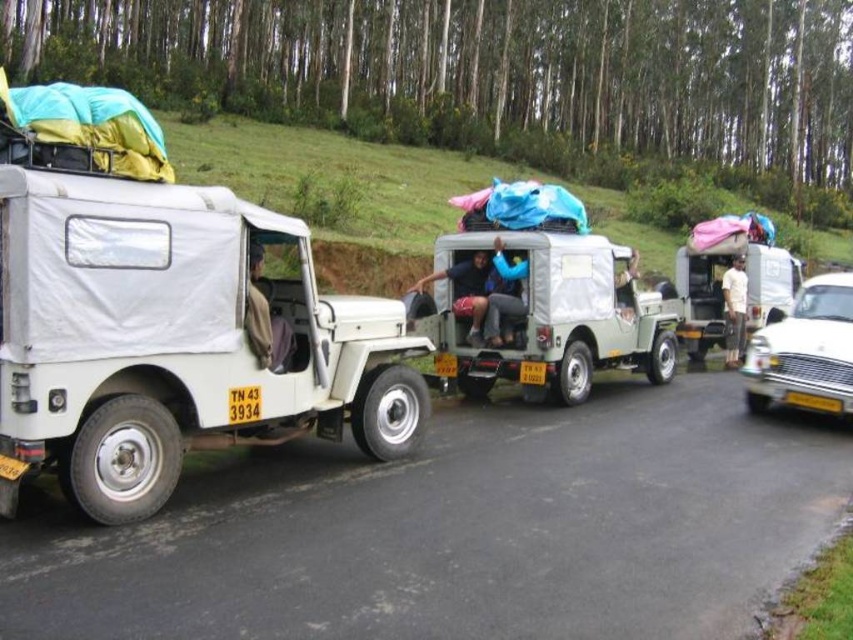
Question: From the image, what is the correct spatial relationship of light blue fabric at center in relation to yellow plastic license plate at center?

Choices:
 (A) above
 (B) below

Answer: (A)

Question: Which point is farther to the camera?

Choices:
 (A) (457, 273)
 (B) (614, 292)
 (C) (788, 396)
 (D) (136, 228)

Answer: (B)

Question: Is white glossy car at right thinner than white cotton shirt at center?

Choices:
 (A) no
 (B) yes

Answer: (B)

Question: Which object is farther from the camera taking this photo?

Choices:
 (A) yellow plastic license plate at center
 (B) white cotton shirt at center
 (C) white glossy car at right
 (D) green matte pickup truck at center

Answer: (C)

Question: Which of the following is the closest to the observer?

Choices:
 (A) (631, 248)
 (B) (547, 320)

Answer: (B)

Question: Does dark blue fabric bag at center have a lesser width compared to yellow plastic license plate at center?

Choices:
 (A) no
 (B) yes

Answer: (A)